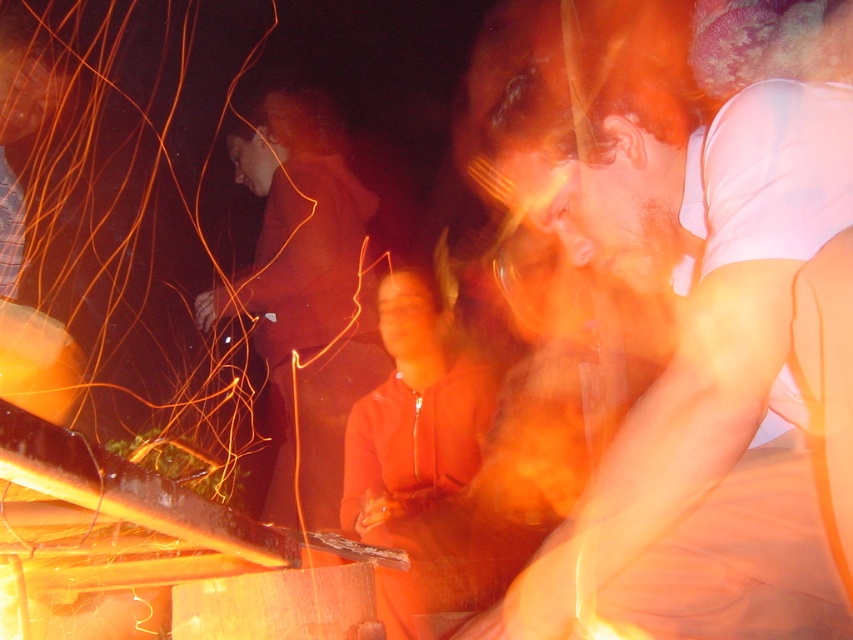
Question: Where is matte orange hoodie at center located in relation to matte orange jacket at center in the image?

Choices:
 (A) right
 (B) left

Answer: (B)

Question: Which point is closer to the camera?

Choices:
 (A) (428, 378)
 (B) (335, 300)
 (C) (726, 525)

Answer: (C)

Question: Can you confirm if matte orange hoodie at center is bigger than matte orange jacket at center?

Choices:
 (A) no
 (B) yes

Answer: (B)

Question: Based on their relative distances, which object is nearer to the smooth white shirt at center?

Choices:
 (A) matte orange hoodie at center
 (B) matte orange jacket at center

Answer: (A)

Question: Does smooth white shirt at center have a smaller size compared to matte orange jacket at center?

Choices:
 (A) yes
 (B) no

Answer: (B)

Question: Which of the following is the closest to the observer?

Choices:
 (A) matte orange jacket at center
 (B) matte orange hoodie at center
 (C) smooth white shirt at center

Answer: (A)